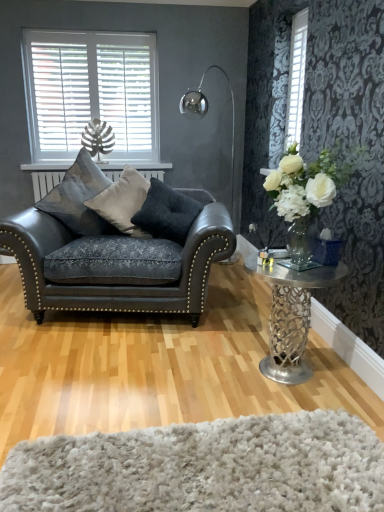
How much space does dark gray fabric pillow at center, the first pillow in the right-to-left sequence, occupy horizontally?

14.31 inches.

Where is `dark gray fabric pillow at center, which is the third pillow from left to right`? The height and width of the screenshot is (512, 384). dark gray fabric pillow at center, which is the third pillow from left to right is located at coordinates (166, 213).

What do you see at coordinates (306, 198) in the screenshot? The image size is (384, 512). I see `white glass vase at right` at bounding box center [306, 198].

This screenshot has width=384, height=512. What do you see at coordinates (204, 467) in the screenshot? I see `white shaggy rug at lower center` at bounding box center [204, 467].

What is the approximate width of metallic silver table at right?

metallic silver table at right is 19.72 inches wide.

At what (x,y) coordinates should I click in order to perform the action: click on white wood blinds at upper left, which ranks as the 1th window in left-to-right order. Please return your answer as a coordinate pair (x, y). Looking at the image, I should click on (91, 92).

What are the coordinates of `white textured blinds at upper right, which appears as the second window when viewed from the back` in the screenshot? It's located at (296, 78).

The height and width of the screenshot is (512, 384). What are the coordinates of `satin blue cushion at left, marked as the third pillow in a right-to-left arrangement` in the screenshot? It's located at (78, 198).

From the image's perspective, which is below, white textured blinds at upper right, which appears as the second window when viewed from the back, or suede-like gray pillow at center, the 2th pillow in the right-to-left sequence?

From the image's view, suede-like gray pillow at center, the 2th pillow in the right-to-left sequence, is below.

From a real-world perspective, is white textured blinds at upper right, arranged as the first window when viewed from the right, beneath suede-like gray pillow at center, the 2th pillow from the left?

No.

In terms of width, does white textured blinds at upper right, arranged as the first window when viewed from the right, look wider or thinner when compared to suede-like gray pillow at center, the 2th pillow in the right-to-left sequence?

In the image, white textured blinds at upper right, arranged as the first window when viewed from the right, appears to be more narrow than suede-like gray pillow at center, the 2th pillow in the right-to-left sequence.

Is white textured blinds at upper right, arranged as the first window when viewed from the right, not inside suede-like gray pillow at center, the 2th pillow from the left?

Absolutely, white textured blinds at upper right, arranged as the first window when viewed from the right, is external to suede-like gray pillow at center, the 2th pillow from the left.

Can you confirm if white textured blinds at upper right, which is counted as the 1th window, starting from the front, is smaller than white glass vase at right?

Correct, white textured blinds at upper right, which is counted as the 1th window, starting from the front, occupies less space than white glass vase at right.

How much distance is there between white textured blinds at upper right, which appears as the second window when viewed from the left, and white glass vase at right?

white textured blinds at upper right, which appears as the second window when viewed from the left, and white glass vase at right are 3.93 feet apart.

Based on the photo, is white textured blinds at upper right, which appears as the second window when viewed from the back, located outside white glass vase at right?

Yes, white textured blinds at upper right, which appears as the second window when viewed from the back, is outside of white glass vase at right.

Does white textured blinds at upper right, arranged as the first window when viewed from the right, lie behind white glass vase at right?

Yes, white textured blinds at upper right, arranged as the first window when viewed from the right, is further from the camera.

How different are the orientations of metallic silver table at right and white textured blinds at upper right, which appears as the second window when viewed from the left, in degrees?

metallic silver table at right and white textured blinds at upper right, which appears as the second window when viewed from the left, are facing 0.00448 degrees away from each other.

The image size is (384, 512). There is a metallic silver table at right. In order to click on the 1st window above it (from the image's perspective) in this screenshot , I will do `click(296, 78)`.

Is metallic silver table at right to the right of white textured blinds at upper right, which appears as the second window when viewed from the back, from the viewer's perspective?

Incorrect, metallic silver table at right is not on the right side of white textured blinds at upper right, which appears as the second window when viewed from the back.

Does metallic silver table at right have a greater height compared to white textured blinds at upper right, which is counted as the 1th window, starting from the front?

No.

Is metallic silver table at right located outside satin blue cushion at left, arranged as the first pillow when viewed from the left?

Absolutely, metallic silver table at right is external to satin blue cushion at left, arranged as the first pillow when viewed from the left.

Is the depth of metallic silver table at right less than that of satin blue cushion at left, arranged as the first pillow when viewed from the left?

Yes, metallic silver table at right is closer to the viewer.

Which is more to the right, metallic silver table at right or satin blue cushion at left, marked as the third pillow in a right-to-left arrangement?

Positioned to the right is metallic silver table at right.

Which is further, [61,211] or [139,73]?

Point [139,73]

How distant is matte black leather couch at left from white wood blinds at upper left, arranged as the 2th window when viewed from the right?

4.19 feet.

At what (x,y) coordinates should I click in order to perform the action: click on window on the left of matte black leather couch at left. Please return your answer as a coordinate pair (x, y). Image resolution: width=384 pixels, height=512 pixels. Looking at the image, I should click on (91, 92).

Consider the image. Is matte black leather couch at left looking in the opposite direction of white wood blinds at upper left, the second window from the front?

No, matte black leather couch at left is not facing the opposite direction of white wood blinds at upper left, the second window from the front.

Is dark gray fabric pillow at center, the first pillow in the right-to-left sequence, not within matte black leather couch at left?

No, dark gray fabric pillow at center, the first pillow in the right-to-left sequence, is not entirely external to matte black leather couch at left.

Is dark gray fabric pillow at center, the first pillow in the right-to-left sequence, facing away from matte black leather couch at left?

Yes, dark gray fabric pillow at center, the first pillow in the right-to-left sequence, is positioned with its back facing matte black leather couch at left.

Is dark gray fabric pillow at center, which is the third pillow from left to right, positioned before matte black leather couch at left?

That is False.

In the scene shown: Is dark gray fabric pillow at center, which is the third pillow from left to right, taller than matte black leather couch at left?

Incorrect, the height of dark gray fabric pillow at center, which is the third pillow from left to right, is not larger of that of matte black leather couch at left.

From the picture: Does metallic silver table at right contain white wood blinds at upper left, arranged as the 2th window when viewed from the right?

No, white wood blinds at upper left, arranged as the 2th window when viewed from the right, is not surrounded by metallic silver table at right.

Considering the sizes of metallic silver table at right and white wood blinds at upper left, which appears as the first window when viewed from the back, in the image, is metallic silver table at right bigger or smaller than white wood blinds at upper left, which appears as the first window when viewed from the back,?

metallic silver table at right is bigger than white wood blinds at upper left, which appears as the first window when viewed from the back.

Who is taller, metallic silver table at right or white wood blinds at upper left, the second window from the front?

Standing taller between the two is white wood blinds at upper left, the second window from the front.

Is metallic silver table at right to the left of white wood blinds at upper left, arranged as the 2th window when viewed from the right, from the viewer's perspective?

No, metallic silver table at right is not to the left of white wood blinds at upper left, arranged as the 2th window when viewed from the right.

What are the coordinates of `the 2nd pillow counting from the left side of the white textured blinds at upper right, which appears as the second window when viewed from the left` in the screenshot? It's located at (122, 202).

You are a GUI agent. You are given a task and a screenshot of the screen. Output one action in this format:
    pyautogui.click(x=<x>, y=<y>)
    Task: Click on the window on the right of white glass vase at right
    The image size is (384, 512).
    Given the screenshot: What is the action you would take?
    pyautogui.click(x=296, y=78)

Based on their spatial positions, is satin blue cushion at left, arranged as the first pillow when viewed from the left, or matte black leather couch at left closer to suede-like gray pillow at center, the 2th pillow in the right-to-left sequence?

satin blue cushion at left, arranged as the first pillow when viewed from the left, is positioned closer to the anchor suede-like gray pillow at center, the 2th pillow in the right-to-left sequence.

Which object lies nearer to the anchor point white glass vase at right, satin blue cushion at left, arranged as the first pillow when viewed from the left, or metallic silver table at right?

metallic silver table at right.

Based on their spatial positions, is satin blue cushion at left, arranged as the first pillow when viewed from the left, or dark gray fabric pillow at center, which is the third pillow from left to right, further from white wood blinds at upper left, arranged as the 2th window when viewed from the right?

Based on the image, dark gray fabric pillow at center, which is the third pillow from left to right, appears to be further to white wood blinds at upper left, arranged as the 2th window when viewed from the right.

Considering their positions, is matte black leather couch at left positioned further to satin blue cushion at left, arranged as the first pillow when viewed from the left, than white shaggy rug at lower center?

white shaggy rug at lower center.

Estimate the real-world distances between objects in this image. Which object is closer to dark gray fabric pillow at center, the first pillow in the right-to-left sequence, suede-like gray pillow at center, the 2th pillow from the left, or metallic silver table at right?

Among the two, suede-like gray pillow at center, the 2th pillow from the left, is located nearer to dark gray fabric pillow at center, the first pillow in the right-to-left sequence.

Consider the image. When comparing their distances from white wood blinds at upper left, which ranks as the 1th window in left-to-right order, does polished metal floor lamp at upper center or white textured blinds at upper right, arranged as the first window when viewed from the right, seem closer?

polished metal floor lamp at upper center is closer to white wood blinds at upper left, which ranks as the 1th window in left-to-right order.

Estimate the real-world distances between objects in this image. Which object is further from suede-like gray pillow at center, the 2th pillow from the left, satin blue cushion at left, marked as the third pillow in a right-to-left arrangement, or dark gray fabric pillow at center, which is the third pillow from left to right?

The object further to suede-like gray pillow at center, the 2th pillow from the left, is dark gray fabric pillow at center, which is the third pillow from left to right.

Looking at the image, which one is located further to matte black leather couch at left, white glass vase at right or white wood blinds at upper left, the second window from the front?

The object further to matte black leather couch at left is white wood blinds at upper left, the second window from the front.

Find the location of a particular element. studio couch between satin blue cushion at left, marked as the third pillow in a right-to-left arrangement, and dark gray fabric pillow at center, which is the third pillow from left to right is located at coordinates (111, 254).

Locate an element on the screen. The width and height of the screenshot is (384, 512). studio couch between satin blue cushion at left, arranged as the first pillow when viewed from the left, and polished metal floor lamp at upper center, in the horizontal direction is located at coordinates (111, 254).

Where is `pillow between white wood blinds at upper left, which appears as the first window when viewed from the back, and suede-like gray pillow at center, the 2th pillow from the left, in the up-down direction`? The width and height of the screenshot is (384, 512). pillow between white wood blinds at upper left, which appears as the first window when viewed from the back, and suede-like gray pillow at center, the 2th pillow from the left, in the up-down direction is located at coordinates (78, 198).

You are a GUI agent. You are given a task and a screenshot of the screen. Output one action in this format:
    pyautogui.click(x=<x>, y=<y>)
    Task: Click on the floral arrangement between white shaggy rug at lower center and dark gray fabric pillow at center, which is the third pillow from left to right, in the front-back direction
    The image size is (384, 512).
    Given the screenshot: What is the action you would take?
    click(x=306, y=198)